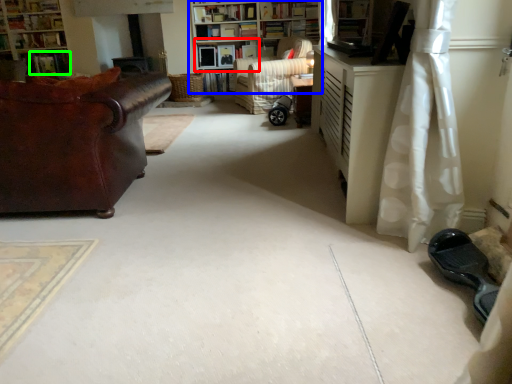
Question: Which object is the farthest from shelf (highlighted by a red box)? Choose among these: bookcase (highlighted by a blue box) or book (highlighted by a green box).

Choices:
 (A) bookcase
 (B) book

Answer: (B)